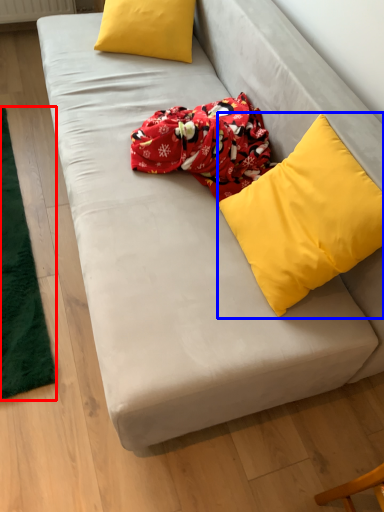
Question: Which point is further to the camera, mat (highlighted by a red box) or pillow (highlighted by a blue box)?

Choices:
 (A) mat
 (B) pillow

Answer: (A)